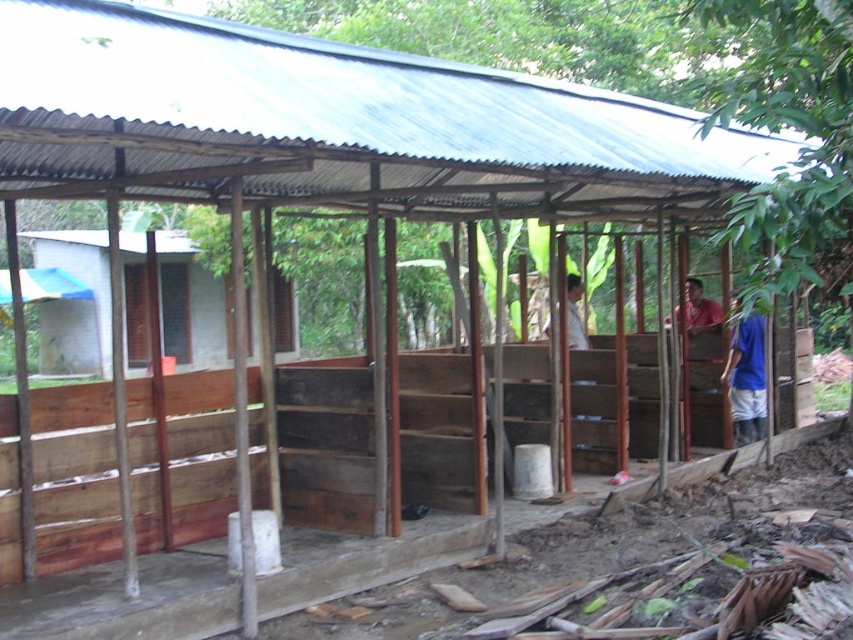
Who is shorter, red shirt at right or blue fabric shirt at right?

blue fabric shirt at right

Between red shirt at right and blue fabric shirt at right, which one is positioned higher?

red shirt at right

Is point (689, 344) behind point (733, 433)?

Yes, point (689, 344) is behind point (733, 433).

I want to click on red shirt at right, so click(705, 368).

You are a GUI agent. You are given a task and a screenshot of the screen. Output one action in this format:
    pyautogui.click(x=<x>, y=<y>)
    Task: Click on the red shirt at right
    
    Given the screenshot: What is the action you would take?
    pyautogui.click(x=705, y=368)

Is point (718, 364) farther from camera compared to point (567, 342)?

Yes, point (718, 364) is farther from viewer.

I want to click on red shirt at right, so click(705, 368).

Identify the location of red shirt at right. (705, 368).

Is blue fabric shirt at right wider than light brown wooden bench at center?

Yes, blue fabric shirt at right is wider than light brown wooden bench at center.

Between blue fabric shirt at right and light brown wooden bench at center, which one appears on the left side from the viewer's perspective?

Positioned to the left is light brown wooden bench at center.

This screenshot has height=640, width=853. In order to click on blue fabric shirt at right in this screenshot , I will do `click(747, 380)`.